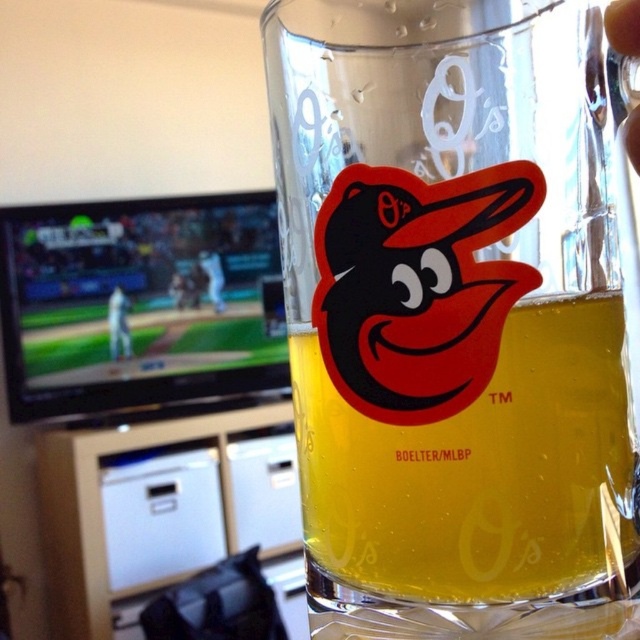
Does translucent glass beer at center appear over white uniform at left?

Incorrect, translucent glass beer at center is not positioned above white uniform at left.

This screenshot has height=640, width=640. Identify the location of translucent glass beer at center. (481, 470).

I want to click on clear glass beer mug at center, so click(x=456, y=316).

Which of these two, clear glass beer mug at center or translucent glass beer at center, stands taller?

clear glass beer mug at center is taller.

Is point (556, 141) closer to viewer compared to point (604, 460)?

Yes, point (556, 141) is in front of point (604, 460).

Where is `clear glass beer mug at center`? The height and width of the screenshot is (640, 640). clear glass beer mug at center is located at coordinates (456, 316).

Looking at this image, measure the distance between clear glass beer mug at center and white uniform at left.

They are 10.23 inches apart.

Is point (396, 595) closer to viewer compared to point (122, 323)?

Yes, point (396, 595) is closer to viewer.

You are a GUI agent. You are given a task and a screenshot of the screen. Output one action in this format:
    pyautogui.click(x=<x>, y=<y>)
    Task: Click on the clear glass beer mug at center
    
    Given the screenshot: What is the action you would take?
    pyautogui.click(x=456, y=316)